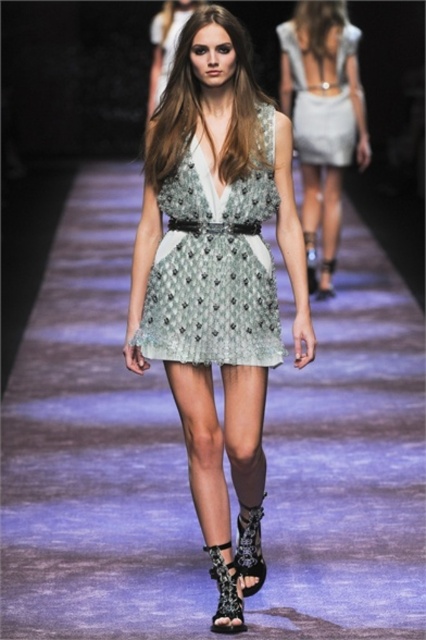
You are a photographer positioned at the center of the runway. You want to capture a closeup shot of the black lace sandal at lower center. Based on its position, which direction should you move to get closer to it?

Since the black lace sandal at lower center is located at point 0.927 on the x axis and 0.531 on the y axis, you should move to the right to get closer to it because the x coordinate is closer to 1, which indicates the right side of the image.

Based on the photo, you are a photographer standing at the back of the runway. You want to capture a closeup shot of the model wearing the satin silver dress at center. The camera you have can focus on subjects within 10 meters. Will you be able to take the photo clearly?

The satin silver dress at center and viewer are 8.93 meters apart from each other. Since the camera can focus within 10 meters, the distance of 8.93 meters is within the focus range. Therefore, you can take the photo clearly.